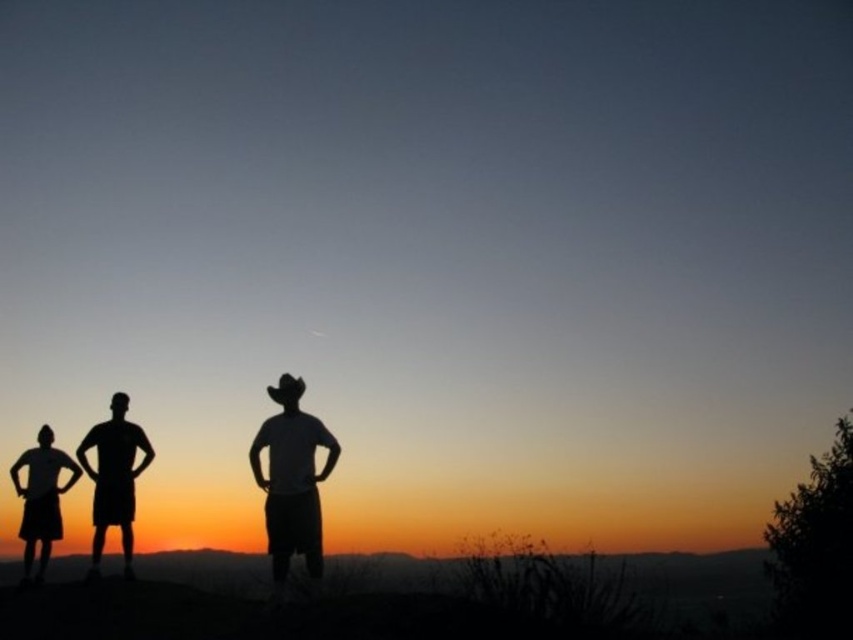
Question: Which point is closer to the camera?

Choices:
 (A) silhouette child at left
 (B) white matte cowboy hat at center

Answer: (B)

Question: Does silhouette cowboy hat at left have a smaller size compared to silhouette child at left?

Choices:
 (A) no
 (B) yes

Answer: (B)

Question: Can you confirm if white matte cowboy hat at center is positioned to the right of silhouette child at left?

Choices:
 (A) yes
 (B) no

Answer: (A)

Question: Is white matte cowboy hat at center above silhouette child at left?

Choices:
 (A) yes
 (B) no

Answer: (A)

Question: Considering the real-world distances, which object is closest to the silhouette cowboy hat at left?

Choices:
 (A) silhouette child at left
 (B) white matte cowboy hat at center

Answer: (A)

Question: Which object is the farthest from the silhouette child at left?

Choices:
 (A) silhouette cowboy hat at left
 (B) white matte cowboy hat at center

Answer: (B)